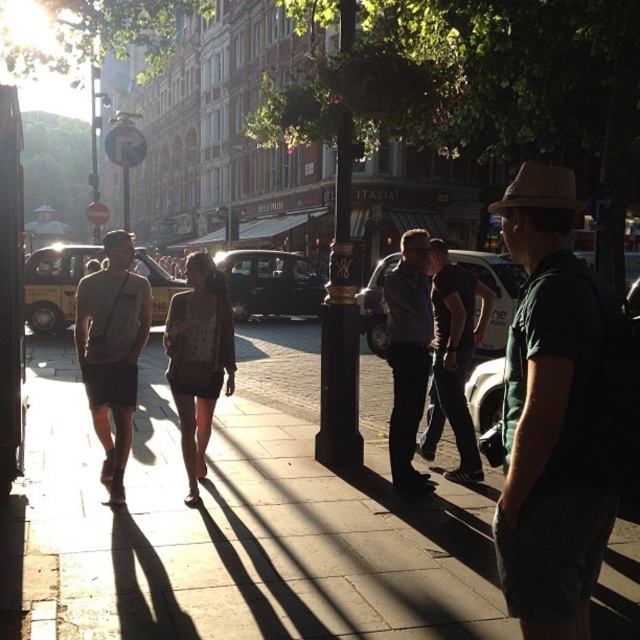
Based on the photo, can you confirm if black polished metal pole at center is shorter than dark gray shirt at center?

In fact, black polished metal pole at center may be taller than dark gray shirt at center.

Is black polished metal pole at center thinner than dark gray shirt at center?

Indeed, black polished metal pole at center has a lesser width compared to dark gray shirt at center.

Where is `black polished metal pole at center`? This screenshot has width=640, height=640. black polished metal pole at center is located at coordinates (339, 326).

How much distance is there between green cotton shirt at right and dark blue shirt at center?

A distance of 3.13 meters exists between green cotton shirt at right and dark blue shirt at center.

Which is more to the left, green cotton shirt at right or dark blue shirt at center?

dark blue shirt at center is more to the left.

You are a GUI agent. You are given a task and a screenshot of the screen. Output one action in this format:
    pyautogui.click(x=<x>, y=<y>)
    Task: Click on the green cotton shirt at right
    This screenshot has height=640, width=640.
    Given the screenshot: What is the action you would take?
    (x=550, y=416)

Find the location of a particular element. green cotton shirt at right is located at coordinates (550, 416).

Can you confirm if brown textured coat at center is bigger than dark gray shirt at center?

No.

Can you confirm if brown textured coat at center is smaller than dark gray shirt at center?

Yes, brown textured coat at center is smaller than dark gray shirt at center.

This screenshot has height=640, width=640. I want to click on brown textured coat at center, so click(198, 358).

This screenshot has width=640, height=640. Find the location of `brown textured coat at center`. brown textured coat at center is located at coordinates (198, 358).